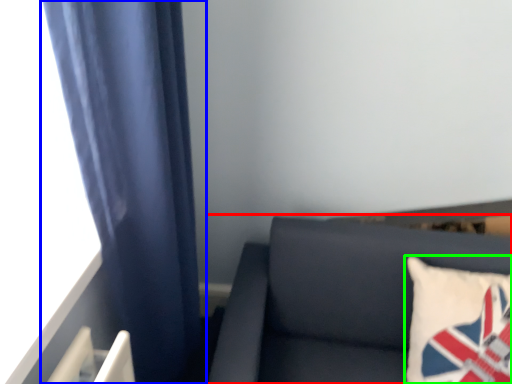
Question: Based on their relative distances, which object is nearer to furniture (highlighted by a red box)? Choose from curtain (highlighted by a blue box) and pillow (highlighted by a green box).

Choices:
 (A) curtain
 (B) pillow

Answer: (B)